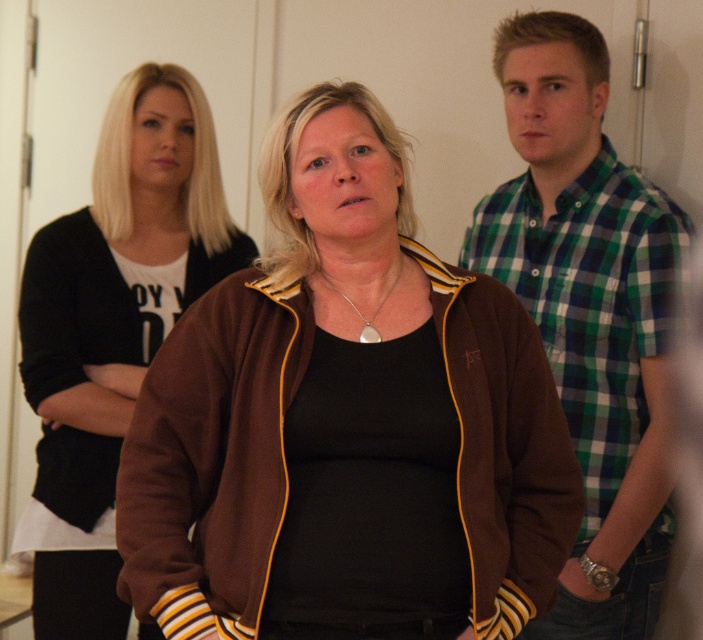
Is green plaid shirt at right behind brown fabric jacket at center?

No, it is not.

Is green plaid shirt at right to the right of brown fabric jacket at center from the viewer's perspective?

Indeed, green plaid shirt at right is positioned on the right side of brown fabric jacket at center.

I want to click on green plaid shirt at right, so click(x=588, y=310).

The height and width of the screenshot is (640, 703). I want to click on green plaid shirt at right, so click(x=588, y=310).

Image resolution: width=703 pixels, height=640 pixels. Describe the element at coordinates (588, 310) in the screenshot. I see `green plaid shirt at right` at that location.

Is green plaid shirt at right smaller than brown fleece jacket at center?

Incorrect, green plaid shirt at right is not smaller in size than brown fleece jacket at center.

What do you see at coordinates (588, 310) in the screenshot?
I see `green plaid shirt at right` at bounding box center [588, 310].

The image size is (703, 640). Find the location of `green plaid shirt at right`. green plaid shirt at right is located at coordinates (588, 310).

Who is more forward, (489, 451) or (101, 550)?

Point (489, 451)

Is brown fleece jacket at center taller than brown fabric jacket at center?

Incorrect, brown fleece jacket at center's height is not larger of brown fabric jacket at center's.

Find the location of a particular element. Image resolution: width=703 pixels, height=640 pixels. brown fleece jacket at center is located at coordinates (209, 448).